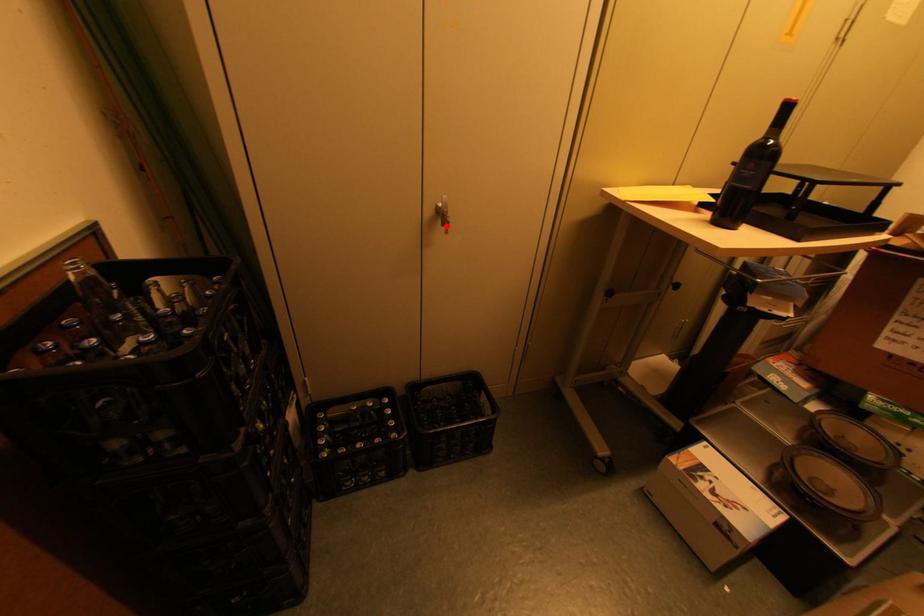
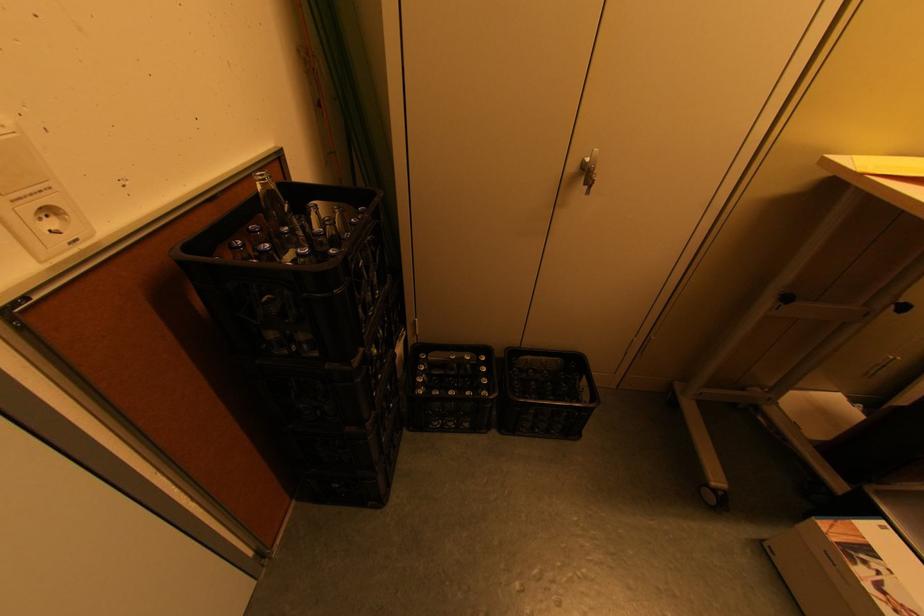
Locate, in the second image, the point that corresponds to the highlighted location in the first image.

(588, 185)